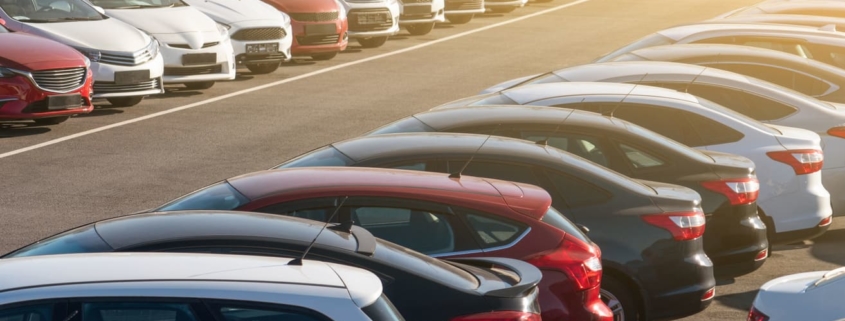
Find the location of `hoods`. hoods is located at coordinates (44, 49), (108, 34), (191, 22), (249, 12), (304, 3), (352, 1), (462, 97), (508, 81).